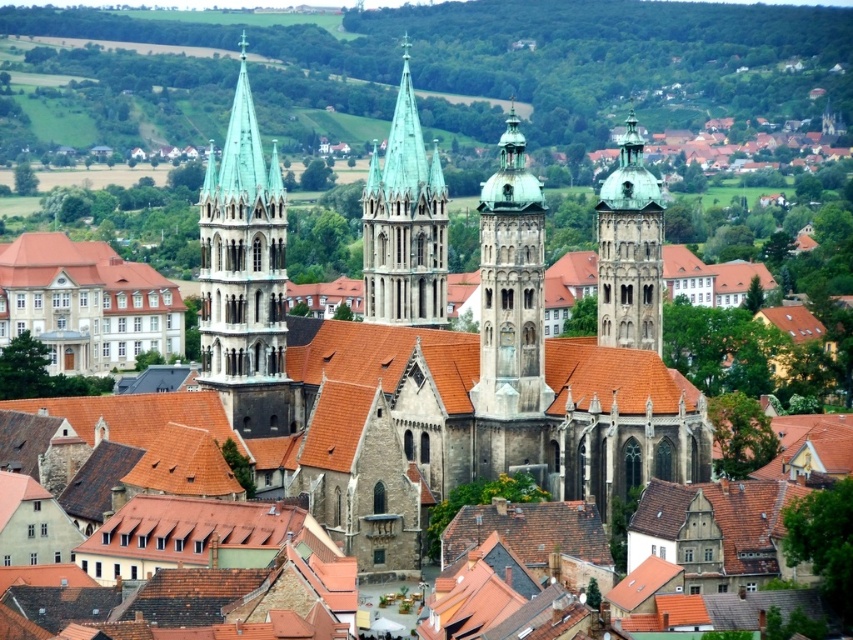
You are standing at the base of the town and looking up at the two stone towers. Which tower, the green stone tower at left or the stone tower at center, appears higher in the visual field?

The green stone tower at left appears higher in the visual field because it is positioned above the stone tower at center.

Consider the image. You are a drone operator tasked with capturing aerial footage of the historic town. Your drone has a maximum flight range of 15 meters. If you are currently positioned at the green stone tower at left, can you fly your drone to the green copper spire at center without exceeding its range?

The distance between the green stone tower at left and the green copper spire at center is 16.40 meters, which exceeds the drone maximum flight range of 15 meters. Therefore, the drone cannot reach the green copper spire at center from the green stone tower at left without exceeding its range.